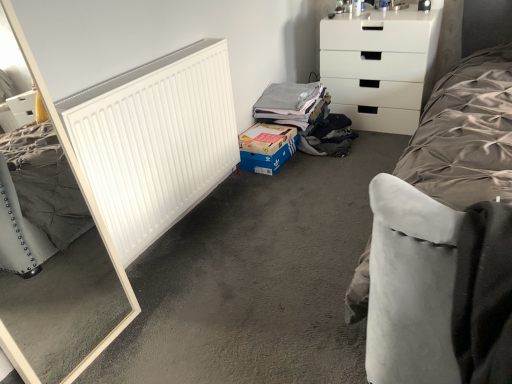
Question: Should I look upward or downward to see white matte radiator at left?

Choices:
 (A) up
 (B) down

Answer: (A)

Question: Is smooth gray carpet at center surrounded by white matte radiator at left?

Choices:
 (A) no
 (B) yes

Answer: (A)

Question: Is white matte radiator at left oriented towards smooth gray carpet at center?

Choices:
 (A) no
 (B) yes

Answer: (B)

Question: Is white matte radiator at left completely or partially outside of smooth gray carpet at center?

Choices:
 (A) yes
 (B) no

Answer: (A)

Question: Is white matte radiator at left next to smooth gray carpet at center?

Choices:
 (A) no
 (B) yes

Answer: (A)

Question: Is white matte radiator at left bigger than smooth gray carpet at center?

Choices:
 (A) yes
 (B) no

Answer: (B)

Question: Would you say white matte radiator at left is a long distance from smooth gray carpet at center?

Choices:
 (A) no
 (B) yes

Answer: (A)

Question: Can you confirm if white glossy chest of drawers at upper right is bigger than smooth gray carpet at center?

Choices:
 (A) yes
 (B) no

Answer: (A)

Question: Can you confirm if white glossy chest of drawers at upper right is taller than smooth gray carpet at center?

Choices:
 (A) no
 (B) yes

Answer: (B)

Question: From a real-world perspective, is white glossy chest of drawers at upper right physically above smooth gray carpet at center?

Choices:
 (A) yes
 (B) no

Answer: (A)

Question: From the image's perspective, is white glossy chest of drawers at upper right below smooth gray carpet at center?

Choices:
 (A) yes
 (B) no

Answer: (B)

Question: From a real-world perspective, is white glossy chest of drawers at upper right under smooth gray carpet at center?

Choices:
 (A) yes
 (B) no

Answer: (B)

Question: From the image's perspective, is white glossy chest of drawers at upper right on smooth gray carpet at center?

Choices:
 (A) yes
 (B) no

Answer: (A)

Question: Considering the relative positions of smooth gray carpet at center and white matte radiator at left in the image provided, is smooth gray carpet at center to the right of white matte radiator at left from the viewer's perspective?

Choices:
 (A) yes
 (B) no

Answer: (A)